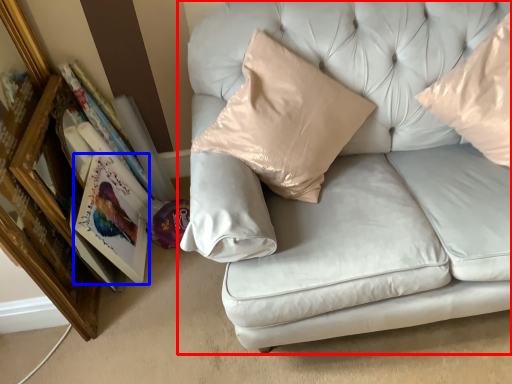
Question: Among these objects, which one is nearest to the camera, studio couch (highlighted by a red box) or paperback book (highlighted by a blue box)?

Choices:
 (A) studio couch
 (B) paperback book

Answer: (A)